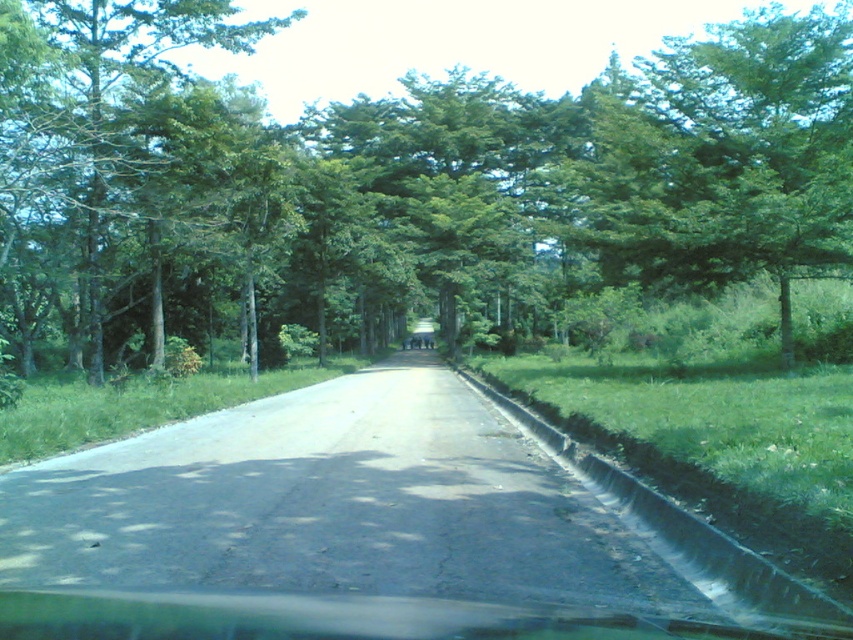
Is green leafy tree at center thinner than green leafy tree at left?

In fact, green leafy tree at center might be wider than green leafy tree at left.

Who is more forward, (x=577, y=288) or (x=137, y=13)?

Point (x=137, y=13) is more forward.

At what (x,y) coordinates should I click in order to perform the action: click on green leafy tree at center. Please return your answer as a coordinate pair (x, y). Looking at the image, I should click on (398, 186).

Does green leafy tree at upper right have a lesser height compared to green leafy tree at left?

Incorrect, green leafy tree at upper right's height does not fall short of green leafy tree at left's.

Can you confirm if green leafy tree at upper right is positioned to the right of green leafy tree at left?

Correct, you'll find green leafy tree at upper right to the right of green leafy tree at left.

Where is `green leafy tree at upper right`? The width and height of the screenshot is (853, 640). green leafy tree at upper right is located at coordinates (729, 156).

The image size is (853, 640). What are the coordinates of `green leafy tree at upper right` in the screenshot? It's located at (729, 156).

Which is more to the left, green leafy tree at center or green leafy tree at upper right?

Positioned to the left is green leafy tree at center.

Describe the element at coordinates (398, 186) in the screenshot. Image resolution: width=853 pixels, height=640 pixels. I see `green leafy tree at center` at that location.

Locate an element on the screen. green leafy tree at center is located at coordinates (398, 186).